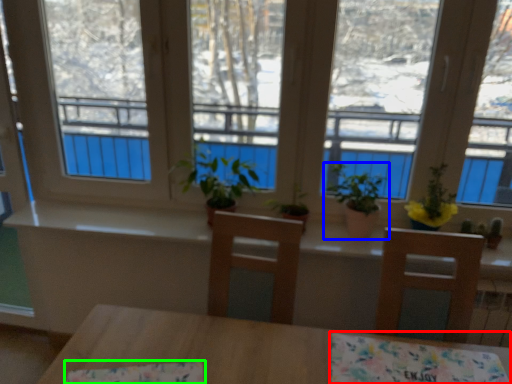
Question: Considering the real-world distances, which object is closest to tablecloth (highlighted by a red box)? houseplant (highlighted by a blue box) or tablecloth (highlighted by a green box).

Choices:
 (A) houseplant
 (B) tablecloth

Answer: (B)